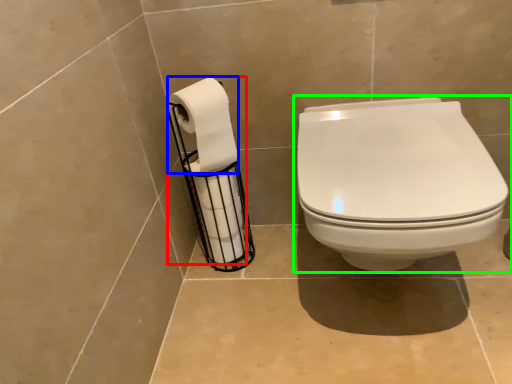
Question: Estimate the real-world distances between objects in this image. Which object is closer to toilet paper (highlighted by a red box), toilet paper (highlighted by a blue box) or toilet (highlighted by a green box)?

Choices:
 (A) toilet paper
 (B) toilet

Answer: (A)